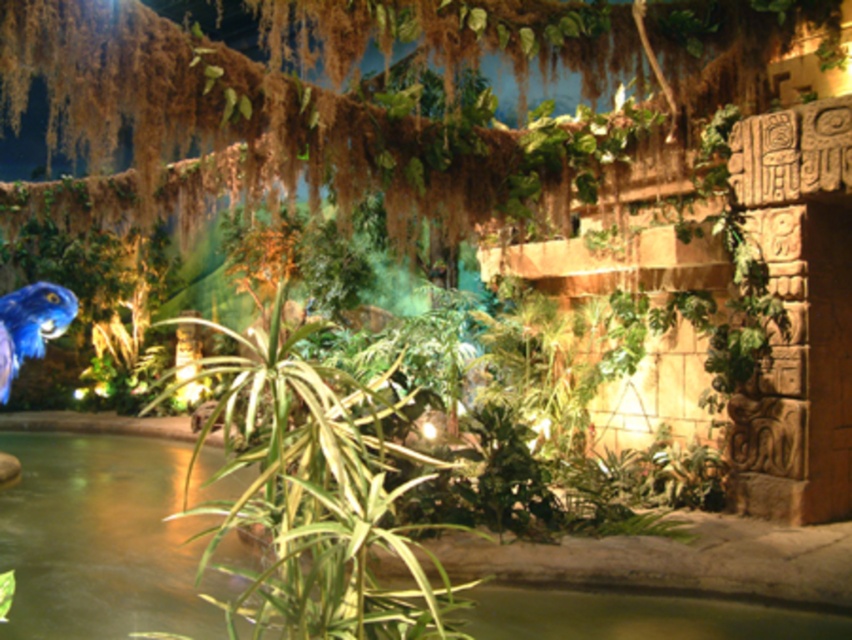
Question: Does green leafy pond at center have a larger size compared to green leafy plant at center?

Choices:
 (A) yes
 (B) no

Answer: (A)

Question: Is green leafy pond at center thinner than green leafy plant at center?

Choices:
 (A) yes
 (B) no

Answer: (B)

Question: Among these points, which one is farthest from the camera?

Choices:
 (A) (114, 496)
 (B) (366, 602)

Answer: (A)

Question: Among these points, which one is farthest from the camera?

Choices:
 (A) (409, 403)
 (B) (216, 580)

Answer: (A)

Question: Can you confirm if green leafy pond at center is smaller than green leafy plant at center?

Choices:
 (A) no
 (B) yes

Answer: (A)

Question: Which point is farther to the camera?

Choices:
 (A) (639, 604)
 (B) (304, 388)

Answer: (A)